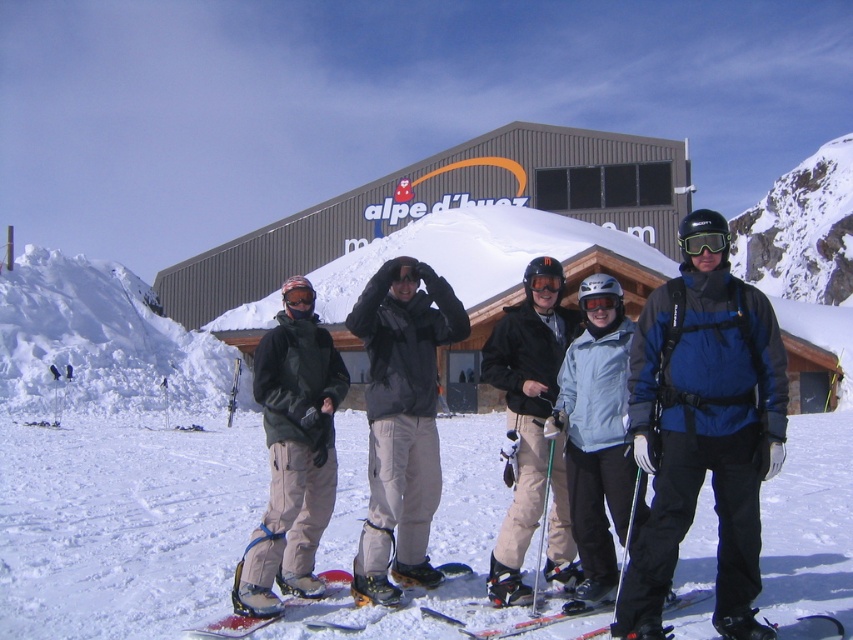
Where is the dark gray fleece jacket at center located in the image?

The dark gray fleece jacket at center is located at point [292,460] in the image.

You are a ski instructor preparing to demonstrate equipment to your students. You have two skis in front of you, the shiny metallic ski at center and the shiny orange ski at center. Which one is bigger?

The shiny metallic ski at center is larger in size compared to the shiny orange ski at center.

You are a photographer trying to capture the perfect shot of the dark gray fleece jacket at center and the shiny metallic ski at center. From the perspective of someone standing in front of them, which object should you position to the left side of your frame?

You should position the dark gray fleece jacket at center to the left side of your frame because it is already located to the left of the shiny metallic ski at center.